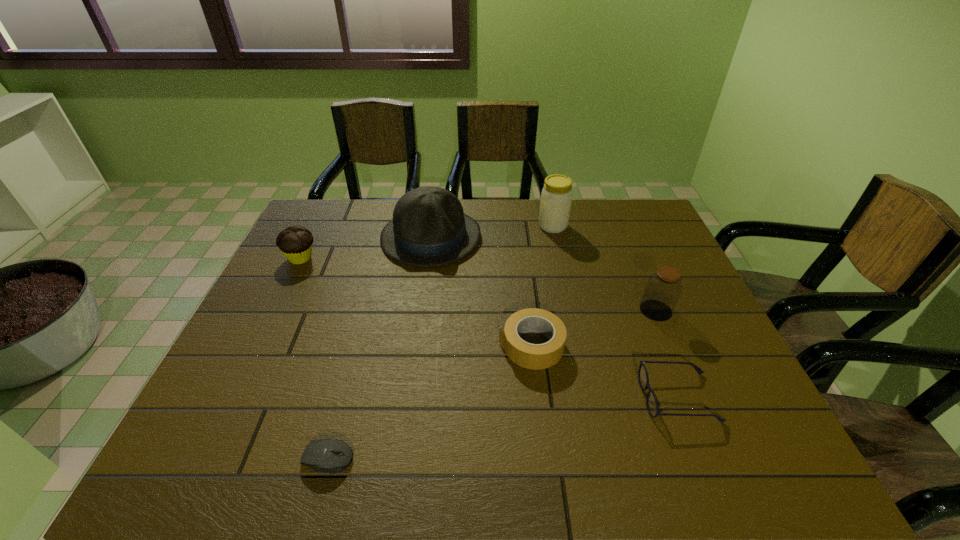
At what (x,y) coordinates should I click in order to perform the action: click on the farther jar. Please return your answer as a coordinate pair (x, y). This screenshot has width=960, height=540. Looking at the image, I should click on (556, 197).

I want to click on the taller jar, so click(x=556, y=197).

This screenshot has height=540, width=960. Find the location of `bowler hat`. bowler hat is located at coordinates (429, 228).

Where is `the shorter jar`? This screenshot has width=960, height=540. the shorter jar is located at coordinates (664, 287).

This screenshot has height=540, width=960. Identify the location of the third tallest object. (x=664, y=287).

Find the location of a particular element. This screenshot has width=960, height=540. muffin is located at coordinates (295, 242).

Image resolution: width=960 pixels, height=540 pixels. I want to click on the fourth tallest object, so click(x=295, y=242).

Locate an element on the screen. The height and width of the screenshot is (540, 960). the third nearest object is located at coordinates (531, 356).

Where is `the second nearest object`? the second nearest object is located at coordinates (652, 404).

At what (x,y) coordinates should I click in order to perform the action: click on the nearest object. Please return your answer as a coordinate pair (x, y). The width and height of the screenshot is (960, 540). Looking at the image, I should click on (318, 455).